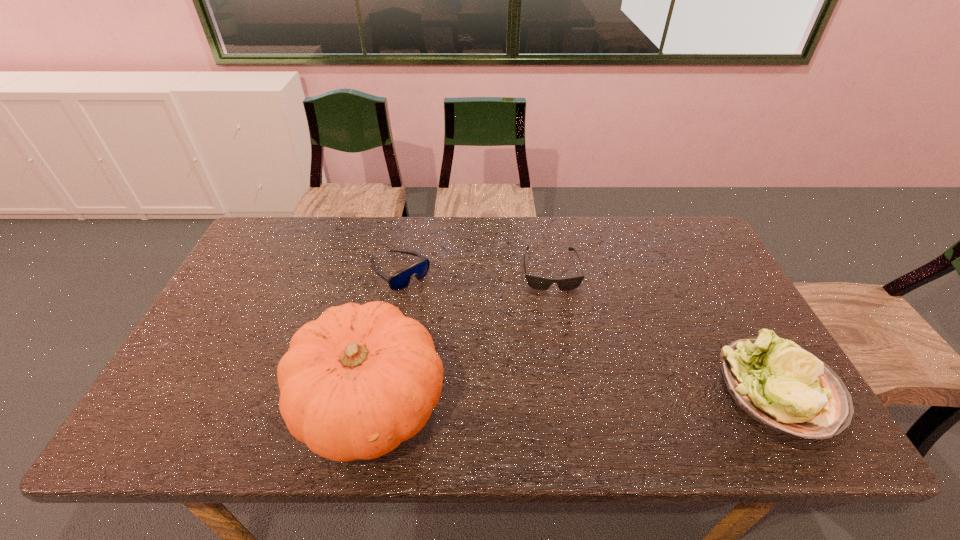
The width and height of the screenshot is (960, 540). Identify the location of free spot on the desktop that is between the tallest object and the rightmost object and is positioned on the front-facing side of the shorter sunglasses. (565, 397).

I want to click on vacant spot on the desktop that is between the pumpkin and the third shortest object and is positioned on the front-facing side of the taller sunglasses, so click(538, 398).